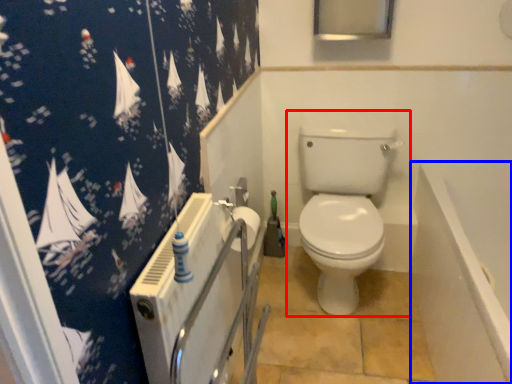
Question: Which point is further to the camera, toilet (highlighted by a red box) or bath (highlighted by a blue box)?

Choices:
 (A) toilet
 (B) bath

Answer: (A)